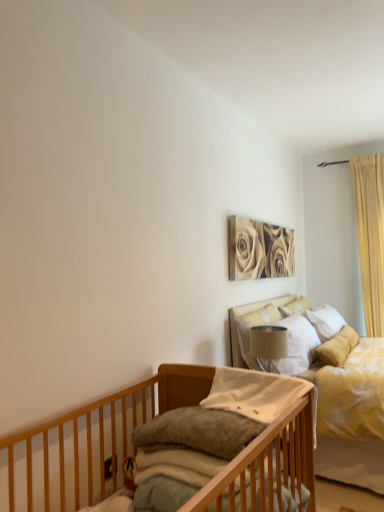
Question: Considering the positions of wooden crib at lower left and yellow fabric curtain at right in the image, is wooden crib at lower left taller or shorter than yellow fabric curtain at right?

Choices:
 (A) tall
 (B) short

Answer: (B)

Question: Relative to yellow fabric curtain at right, is wooden crib at lower left in front or behind?

Choices:
 (A) front
 (B) behind

Answer: (A)

Question: Which object is positioned farthest from the white soft pillow at upper right, which is the third pillow from left to right?

Choices:
 (A) soft white pillow at center, the first pillow in the left-to-right sequence
 (B) satin white pillow at upper center, marked as the second pillow in a front-to-back arrangement
 (C) beige fabric lampshade at upper center
 (D) yellow fabric bed at upper right
 (E) yellow fabric curtain at right

Answer: (A)

Question: Which of these objects is positioned farthest from the yellow fabric bed at upper right?

Choices:
 (A) satin white pillow at upper center, which is counted as the second pillow, starting from the back
 (B) sepia-toned canvas at upper center
 (C) white soft pillow at upper right, which is the 3th pillow in front-to-back order
 (D) beige fabric lampshade at upper center
 (E) soft white pillow at center, which appears as the 3th pillow when viewed from the back

Answer: (E)